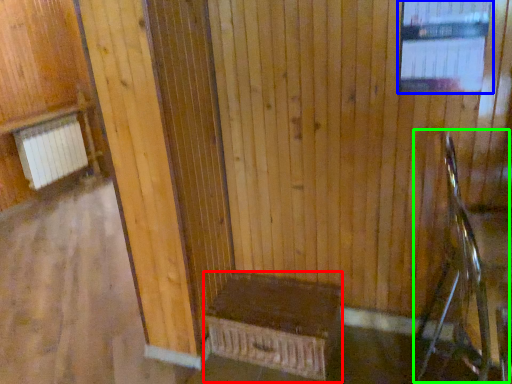
Question: Based on their relative distances, which object is farther from furniture (highlighted by a red box)? Choose from window (highlighted by a blue box) and rocking chair (highlighted by a green box).

Choices:
 (A) window
 (B) rocking chair

Answer: (A)